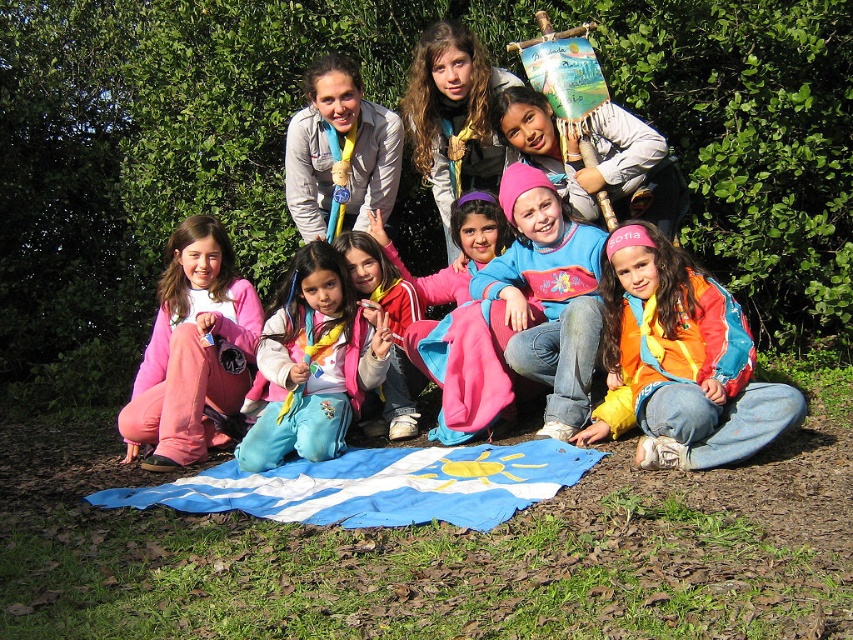
Between point (514, 464) and point (288, 144), which one is positioned behind?

The point (288, 144) is behind.

Between blue fabric flag at lower center and matte gray jacket at upper center, which one appears on the right side from the viewer's perspective?

Positioned to the right is blue fabric flag at lower center.

You are a GUI agent. You are given a task and a screenshot of the screen. Output one action in this format:
    pyautogui.click(x=<x>, y=<y>)
    Task: Click on the blue fabric flag at lower center
    The height and width of the screenshot is (640, 853).
    Given the screenshot: What is the action you would take?
    pyautogui.click(x=378, y=484)

Is blue fabric flag at lower center below matte pink pants at center?

Correct, blue fabric flag at lower center is located below matte pink pants at center.

Which of these two, blue fabric flag at lower center or matte pink pants at center, stands taller?

Standing taller between the two is matte pink pants at center.

Find the location of a particular element. The width and height of the screenshot is (853, 640). blue fabric flag at lower center is located at coordinates (378, 484).

Describe the element at coordinates (547, 296) in the screenshot. The width and height of the screenshot is (853, 640). I see `pink fleece jacket at center` at that location.

Measure the distance between point (509, 195) and camera.

Point (509, 195) is 5.97 meters away from camera.

Which is in front, point (531, 196) or point (399, 140)?

Positioned in front is point (531, 196).

The image size is (853, 640). I want to click on pink fleece jacket at center, so click(x=547, y=296).